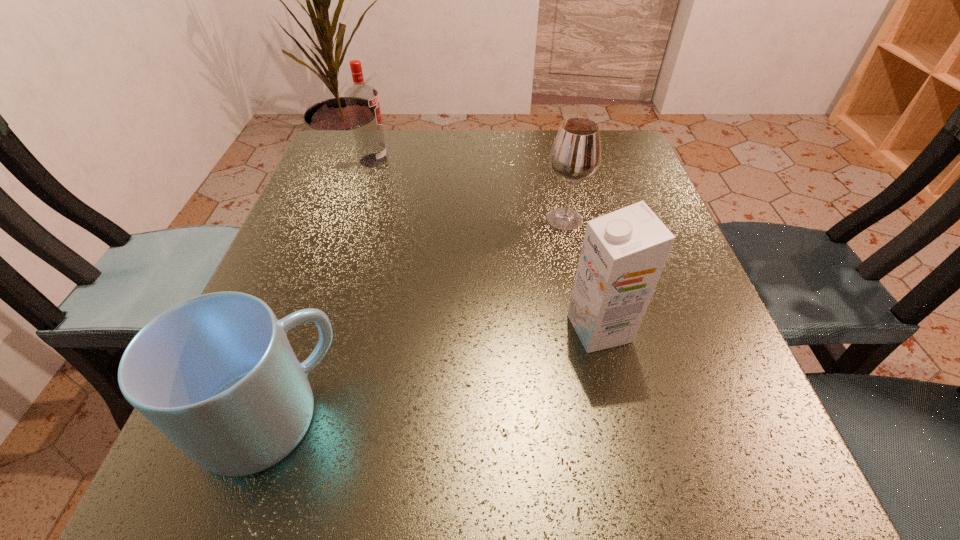
Where is `vodka situated at the left edge`? This screenshot has height=540, width=960. vodka situated at the left edge is located at coordinates point(362,101).

This screenshot has width=960, height=540. In order to click on mug that is at the left edge in this screenshot , I will do `click(216, 374)`.

Find the location of `carton that is at the right edge`. carton that is at the right edge is located at coordinates (623, 253).

The width and height of the screenshot is (960, 540). In order to click on wineglass that is at the right edge in this screenshot , I will do `click(575, 156)`.

Where is `object present at the far left corner`? The width and height of the screenshot is (960, 540). object present at the far left corner is located at coordinates (362, 101).

This screenshot has width=960, height=540. In order to click on object that is at the near left corner in this screenshot , I will do [216, 374].

Locate an element on the screen. vacant area at the left edge is located at coordinates (327, 217).

Image resolution: width=960 pixels, height=540 pixels. Identify the location of blank space at the right edge of the desktop. coord(656,403).

Where is `free space at the far left corner of the desktop`? The width and height of the screenshot is (960, 540). free space at the far left corner of the desktop is located at coordinates (378, 182).

Find the location of `free space at the far right corner of the desktop`. free space at the far right corner of the desktop is located at coordinates (606, 171).